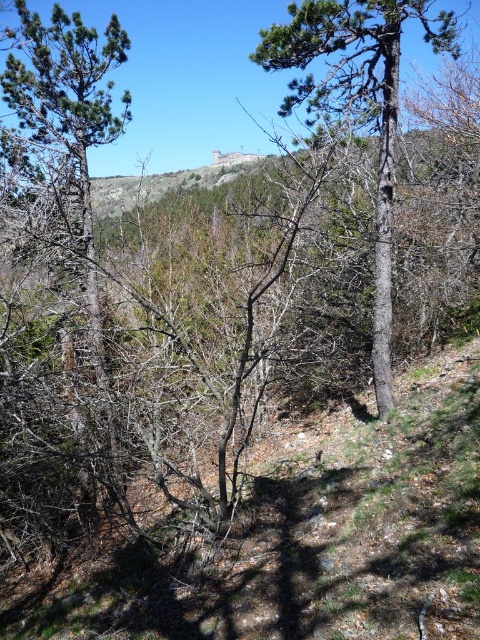
Question: Which object is closer to the camera taking this photo?

Choices:
 (A) green pine tree at left
 (B) smooth bark tree at center

Answer: (B)

Question: In this image, where is smooth bark tree at center located relative to green pine tree at left?

Choices:
 (A) below
 (B) above

Answer: (A)

Question: Can you confirm if smooth bark tree at center is smaller than green pine tree at left?

Choices:
 (A) no
 (B) yes

Answer: (A)

Question: Is smooth bark tree at center above green pine tree at left?

Choices:
 (A) yes
 (B) no

Answer: (B)

Question: Which point is closer to the camera?

Choices:
 (A) (282, 51)
 (B) (54, 67)

Answer: (A)